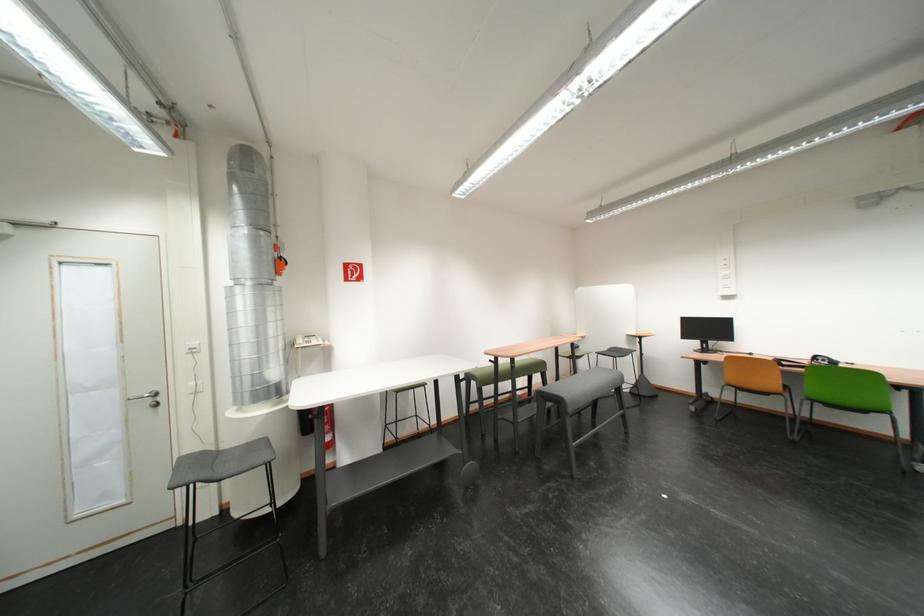
This screenshot has height=616, width=924. Identify the location of red fire extinguisher. (278, 260).